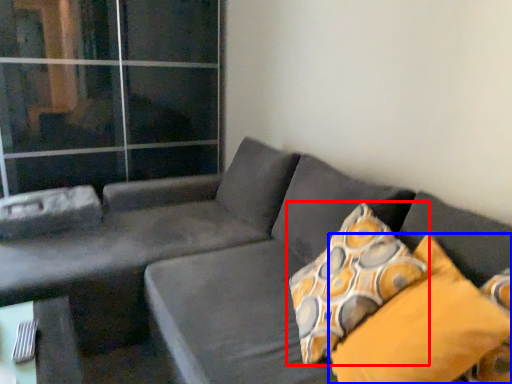
Question: Which of the following is the closest to the observer, pillow (highlighted by a red box) or pillow (highlighted by a blue box)?

Choices:
 (A) pillow
 (B) pillow

Answer: (B)